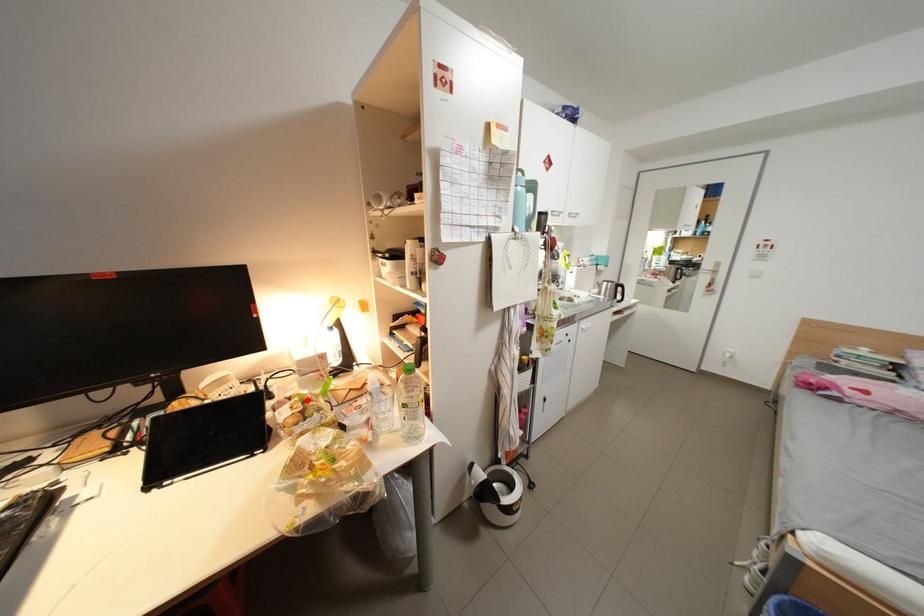
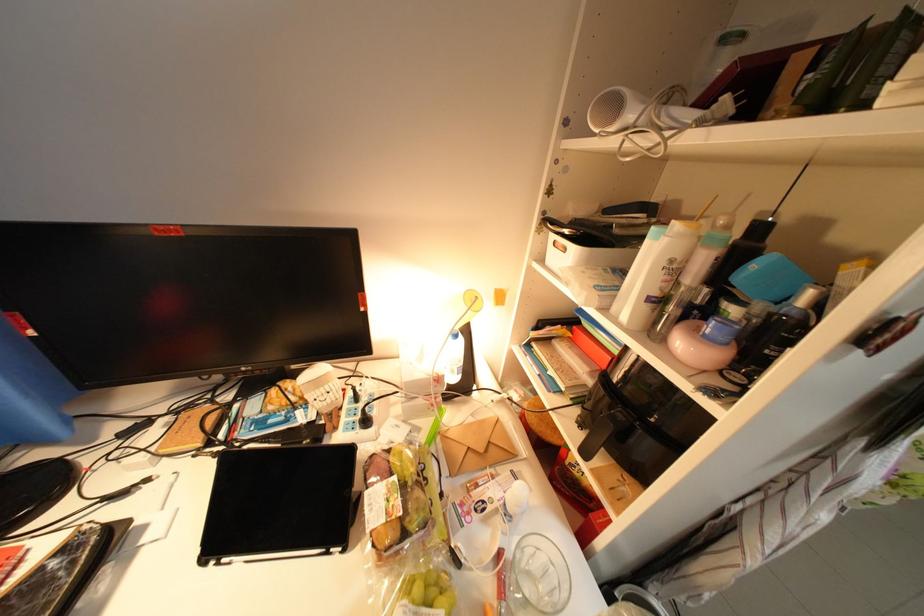
The point at the highlighted location is marked in the first image. Where is the corresponding point in the second image?

(407, 479)